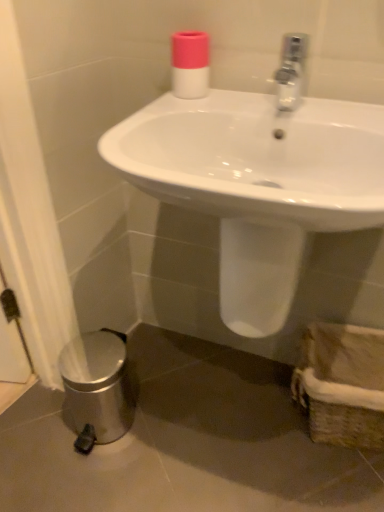
Question: Relative to pink matte bottle at upper center, is brown woven basket at lower right in front or behind?

Choices:
 (A) behind
 (B) front

Answer: (A)

Question: In terms of width, does brown woven basket at lower right look wider or thinner when compared to pink matte bottle at upper center?

Choices:
 (A) thin
 (B) wide

Answer: (B)

Question: Which object is the farthest from the white glossy sink at center?

Choices:
 (A) pink matte bottle at upper center
 (B) brown woven basket at lower right

Answer: (B)

Question: Which of these objects is positioned closest to the white glossy sink at center?

Choices:
 (A) brown woven basket at lower right
 (B) pink matte bottle at upper center

Answer: (B)